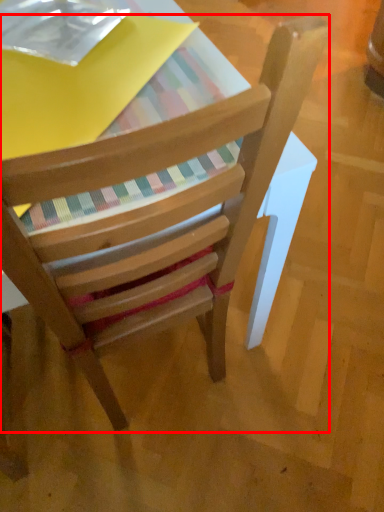
Question: From the image's perspective, where is chair (annotated by the red box) located relative to paperback book?

Choices:
 (A) below
 (B) above

Answer: (A)